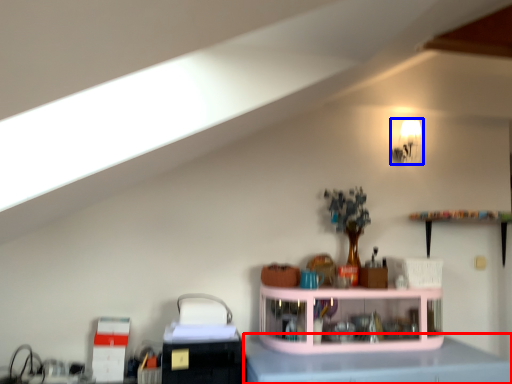
Question: Which object appears farthest to the camera in this image, counter top (highlighted by a red box) or light fixture (highlighted by a blue box)?

Choices:
 (A) counter top
 (B) light fixture

Answer: (B)